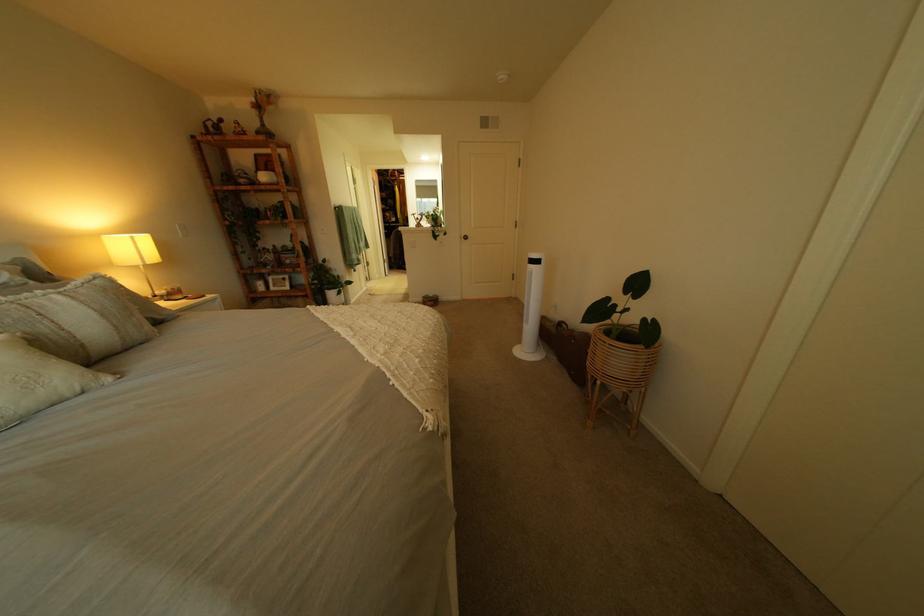
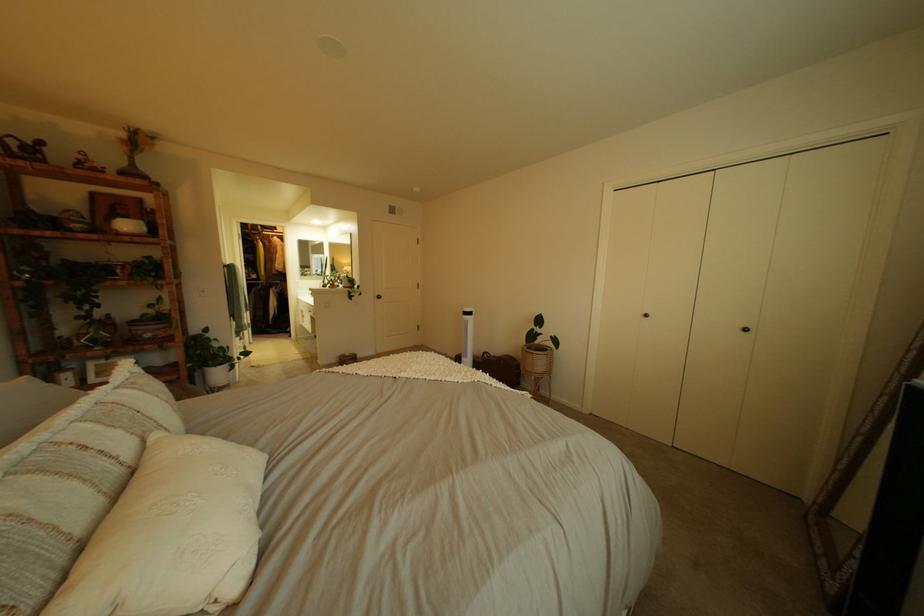
Locate, in the second image, the point that corresponds to [433,361] in the first image.

(504, 376)